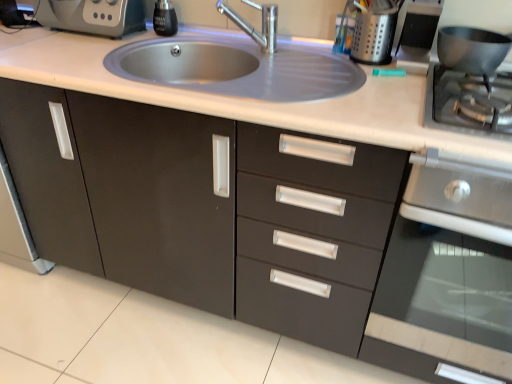
Question: Does black glass soap dispenser at upper center have a greater width compared to satin steel sink at center?

Choices:
 (A) no
 (B) yes

Answer: (A)

Question: From a real-world perspective, is black glass soap dispenser at upper center on satin steel sink at center?

Choices:
 (A) yes
 (B) no

Answer: (A)

Question: Could you tell me if black glass soap dispenser at upper center is turned towards satin steel sink at center?

Choices:
 (A) yes
 (B) no

Answer: (B)

Question: Can you see black glass soap dispenser at upper center touching satin steel sink at center?

Choices:
 (A) no
 (B) yes

Answer: (A)

Question: From the image's perspective, is black glass soap dispenser at upper center located beneath satin steel sink at center?

Choices:
 (A) no
 (B) yes

Answer: (A)

Question: Considering the positions of satin steel sink at center and satin silver utensil holder at upper right, which is counted as the first appliance, starting from the left, in the image, is satin steel sink at center taller or shorter than satin silver utensil holder at upper right, which is counted as the first appliance, starting from the left,?

Choices:
 (A) short
 (B) tall

Answer: (A)

Question: From a real-world perspective, relative to satin silver utensil holder at upper right, which is counted as the first appliance, starting from the left, is satin steel sink at center vertically above or below?

Choices:
 (A) above
 (B) below

Answer: (B)

Question: Which is correct: satin steel sink at center is inside satin silver utensil holder at upper right, acting as the 3th appliance starting from the right, or outside of it?

Choices:
 (A) inside
 (B) outside

Answer: (B)

Question: In terms of size, does satin steel sink at center appear bigger or smaller than satin silver utensil holder at upper right, acting as the 3th appliance starting from the right?

Choices:
 (A) small
 (B) big

Answer: (B)

Question: Considering the positions of point (282, 52) and point (475, 334), is point (282, 52) closer or farther from the camera than point (475, 334)?

Choices:
 (A) closer
 (B) farther

Answer: (B)

Question: Is satin steel sink at center bigger or smaller than stainless steel oven at right?

Choices:
 (A) small
 (B) big

Answer: (A)

Question: Is satin steel sink at center taller or shorter than stainless steel oven at right?

Choices:
 (A) tall
 (B) short

Answer: (B)

Question: Considering their positions, is satin steel sink at center located in front of or behind stainless steel oven at right?

Choices:
 (A) front
 (B) behind

Answer: (B)

Question: Based on their sizes in the image, would you say stainless steel gas stove at right is bigger or smaller than stainless steel oven at right?

Choices:
 (A) small
 (B) big

Answer: (A)

Question: Do you think stainless steel gas stove at right is within stainless steel oven at right, or outside of it?

Choices:
 (A) outside
 (B) inside

Answer: (A)